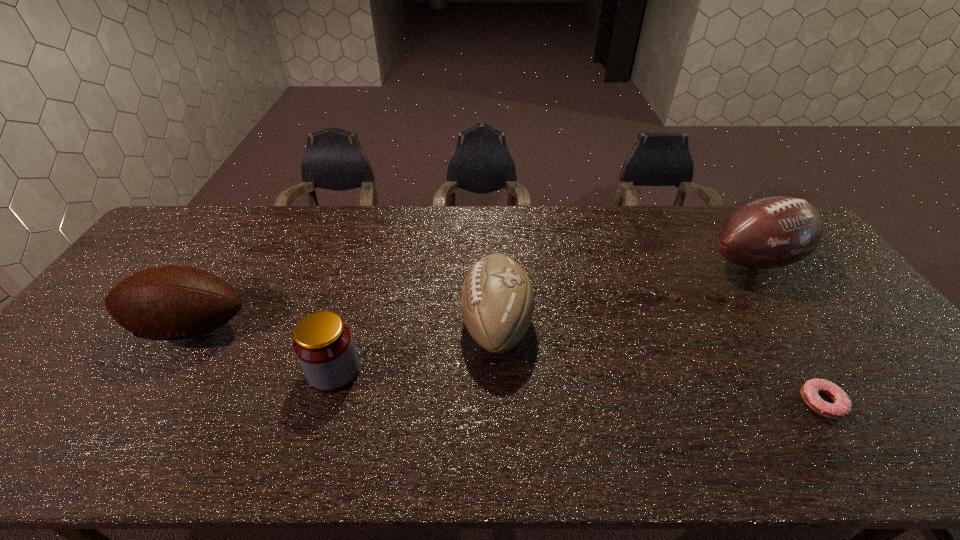
Locate an element on the screen. the rightmost football (American) is located at coordinates (x=772, y=232).

At what (x,y) coordinates should I click in order to perform the action: click on the leftmost object. Please return your answer as a coordinate pair (x, y). Looking at the image, I should click on (168, 302).

Locate an element on the screen. the third object from right to left is located at coordinates (497, 299).

In order to click on the fourth object from right to left in this screenshot , I will do `click(323, 343)`.

The image size is (960, 540). I want to click on jar, so click(x=323, y=343).

Find the location of a particular element. This screenshot has height=540, width=960. doughnut is located at coordinates click(x=841, y=407).

Where is `free location located 0.350m on the front of the rightmost football (American)`? The height and width of the screenshot is (540, 960). free location located 0.350m on the front of the rightmost football (American) is located at coordinates (843, 389).

Identify the location of vacant space situated 0.110m on the laces of the leftmost football (American). (149, 394).

The height and width of the screenshot is (540, 960). In order to click on free space located 0.260m on the laces of the third object from left to right in this screenshot , I will do `click(366, 325)`.

In order to click on vacant point located on the laces of the third object from left to right in this screenshot , I will do `click(325, 325)`.